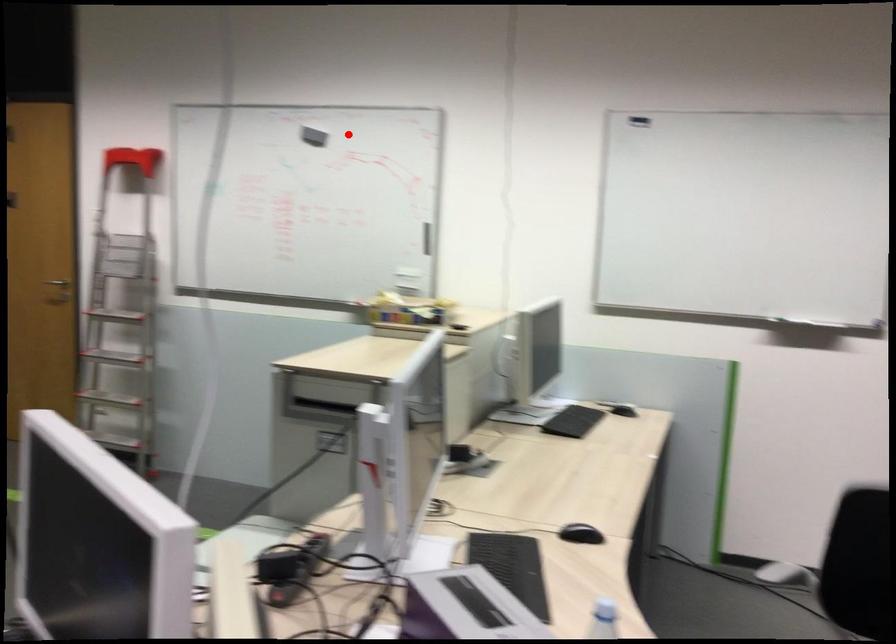
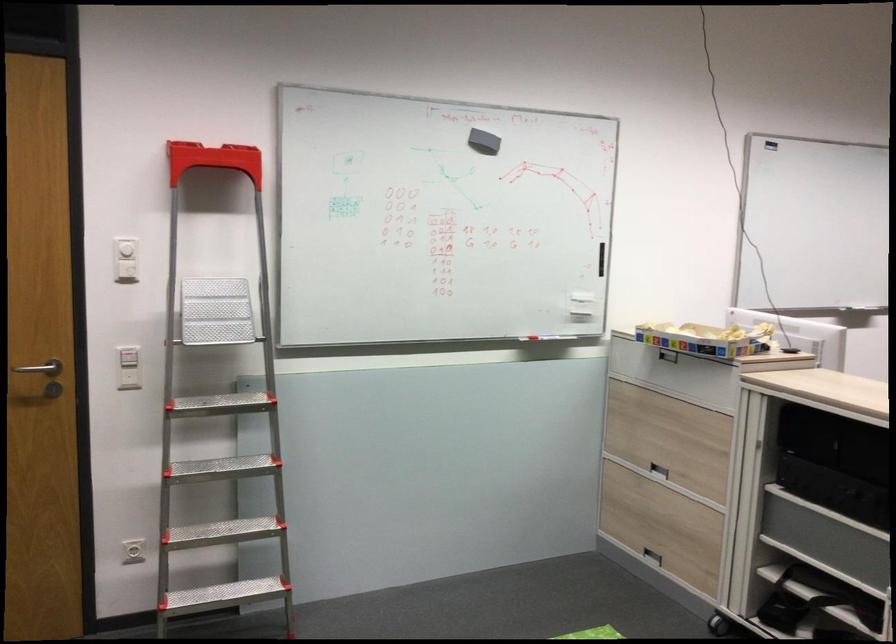
Question: I am providing you with two images of the same scene from different viewpoints. A red point is shown in image1. For the corresponding object point in image2, is it positioned nearer or farther from the camera?

Choices:
 (A) Nearer
 (B) Farther

Answer: (A)